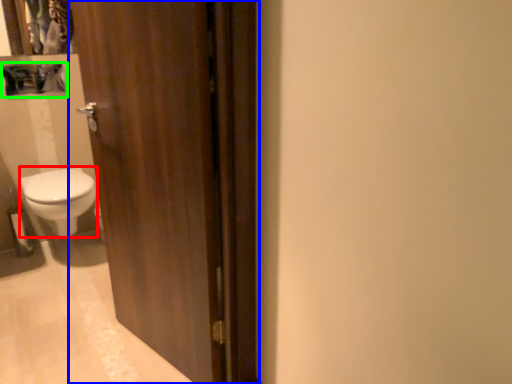
Question: Considering the real-world distances, which object is farthest from bidet (highlighted by a red box)? door (highlighted by a blue box) or medicine cabinet (highlighted by a green box)?

Choices:
 (A) door
 (B) medicine cabinet

Answer: (A)